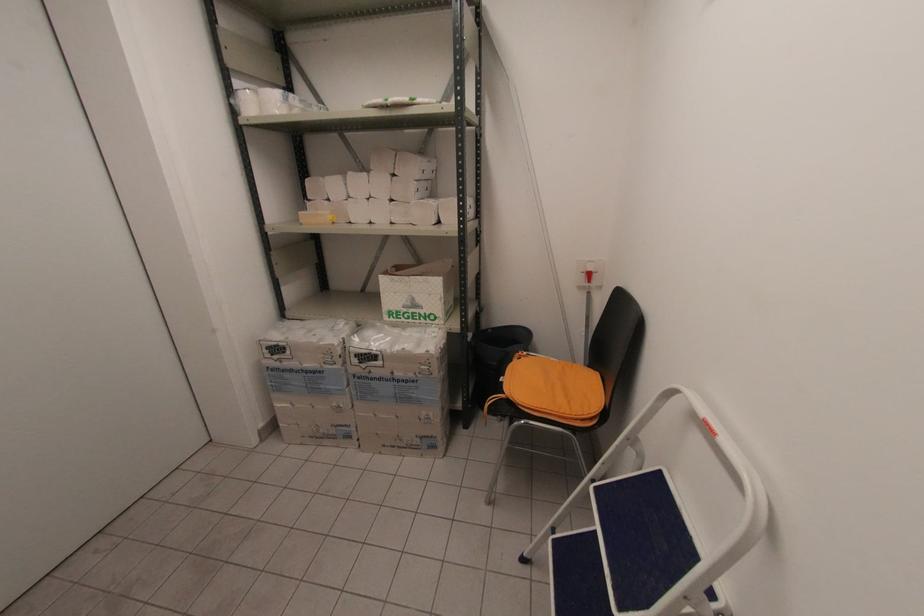
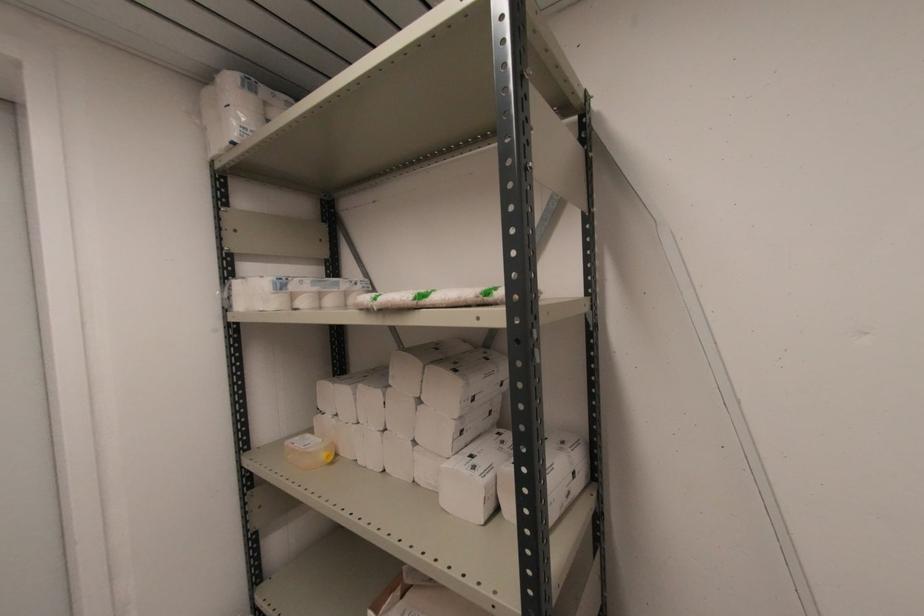
The images are taken continuously from a first-person perspective. In which direction is your viewpoint rotating?

The rotation direction of the camera is left-up.